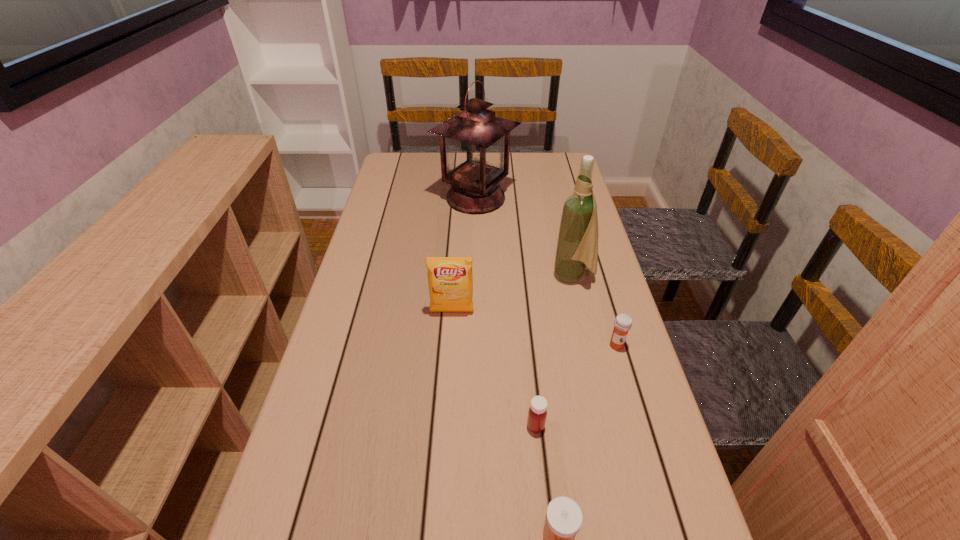
Identify the location of vacant space at the far right corner of the desktop. (566, 173).

Find the location of a particular element. The width and height of the screenshot is (960, 540). unoccupied area between the rightmost medicine and the third farthest object is located at coordinates (534, 329).

Image resolution: width=960 pixels, height=540 pixels. I want to click on empty space that is in between the second nearest object and the rightmost medicine, so [576, 386].

The width and height of the screenshot is (960, 540). In order to click on free spot between the fourth farthest object and the farthest object in this screenshot , I will do `click(546, 272)`.

You are a GUI agent. You are given a task and a screenshot of the screen. Output one action in this format:
    pyautogui.click(x=<x>, y=<y>)
    Task: Click on the free spot between the crisp (potato chip) and the farthest medicine
    
    Given the screenshot: What is the action you would take?
    pyautogui.click(x=534, y=329)

Where is `vacant space that is in between the farthest object and the wine bottle`? The width and height of the screenshot is (960, 540). vacant space that is in between the farthest object and the wine bottle is located at coordinates (525, 237).

Where is `free space between the second nearest medicine and the third farthest object`? free space between the second nearest medicine and the third farthest object is located at coordinates (493, 369).

Locate an element on the screen. The width and height of the screenshot is (960, 540). vacant space that is in between the second farthest object and the farthest object is located at coordinates (525, 237).

The height and width of the screenshot is (540, 960). What are the coordinates of `free spot between the third farthest object and the farthest object` in the screenshot? It's located at (464, 255).

The width and height of the screenshot is (960, 540). What are the coordinates of `vacant space that's between the fifth farthest object and the farthest object` in the screenshot? It's located at (506, 312).